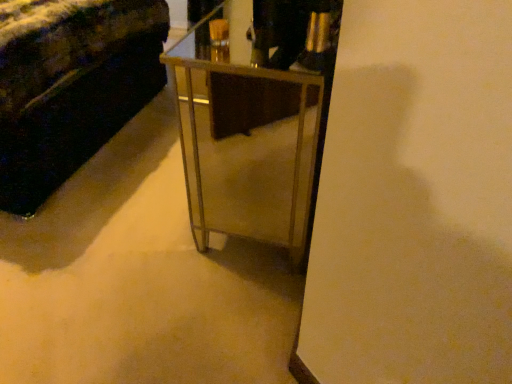
Image resolution: width=512 pixels, height=384 pixels. I want to click on metallic gold table at center, so click(253, 119).

This screenshot has width=512, height=384. What do you see at coordinates (253, 119) in the screenshot?
I see `metallic gold table at center` at bounding box center [253, 119].

Image resolution: width=512 pixels, height=384 pixels. Describe the element at coordinates (70, 86) in the screenshot. I see `velvet dark green couch at left` at that location.

You are a GUI agent. You are given a task and a screenshot of the screen. Output one action in this format:
    pyautogui.click(x=<x>, y=<y>)
    Task: Click on the velvet dark green couch at left
    
    Given the screenshot: What is the action you would take?
    pyautogui.click(x=70, y=86)

What is the approximate height of velvet dark green couch at left?

32.98 inches.

Where is `metallic gold table at center`? Image resolution: width=512 pixels, height=384 pixels. metallic gold table at center is located at coordinates (253, 119).

Is metallic gold table at center at the right side of velvet dark green couch at left?

Yes.

In the scene shown: Which object is closer to the camera taking this photo, metallic gold table at center or velvet dark green couch at left?

Positioned in front is metallic gold table at center.

Considering the points (217, 171) and (94, 147), which point is behind, point (217, 171) or point (94, 147)?

Point (94, 147)

From the image's perspective, which object appears higher, metallic gold table at center or velvet dark green couch at left?

velvet dark green couch at left, from the image's perspective.

From a real-world perspective, is metallic gold table at center positioned above or below velvet dark green couch at left?

In terms of real-world spatial position, metallic gold table at center is below velvet dark green couch at left.

Considering the relative sizes of metallic gold table at center and velvet dark green couch at left in the image provided, is metallic gold table at center thinner than velvet dark green couch at left?

Correct, the width of metallic gold table at center is less than that of velvet dark green couch at left.

Which of these two, metallic gold table at center or velvet dark green couch at left, stands shorter?

metallic gold table at center is shorter.

Considering the sizes of metallic gold table at center and velvet dark green couch at left in the image, is metallic gold table at center bigger or smaller than velvet dark green couch at left?

metallic gold table at center is smaller than velvet dark green couch at left.

Is metallic gold table at center situated inside velvet dark green couch at left or outside?

metallic gold table at center lies outside velvet dark green couch at left.

Can you see metallic gold table at center touching velvet dark green couch at left?

No, metallic gold table at center is not in contact with velvet dark green couch at left.

Consider the image. Is metallic gold table at center oriented away from velvet dark green couch at left?

No, metallic gold table at center is not facing away from velvet dark green couch at left.

Locate an element on the screen. The image size is (512, 384). furniture on the left of metallic gold table at center is located at coordinates coord(70,86).

In the image, is velvet dark green couch at left on the left side or the right side of metallic gold table at center?

Based on their positions, velvet dark green couch at left is located to the left of metallic gold table at center.

Looking at this image, which object is closer to the camera taking this photo, velvet dark green couch at left or metallic gold table at center?

Positioned in front is metallic gold table at center.

Does point (122, 50) come behind point (323, 48)?

Yes, it is.

Based on the photo, from the image's perspective, does velvet dark green couch at left appear lower than metallic gold table at center?

No.

From a real-world perspective, is velvet dark green couch at left physically below metallic gold table at center?

No, from a real-world perspective, velvet dark green couch at left is not under metallic gold table at center.

Considering the relative sizes of velvet dark green couch at left and metallic gold table at center in the image provided, is velvet dark green couch at left thinner than metallic gold table at center?

No, velvet dark green couch at left is not thinner than metallic gold table at center.

Can you confirm if velvet dark green couch at left is shorter than metallic gold table at center?

No, velvet dark green couch at left is not shorter than metallic gold table at center.

Can you confirm if velvet dark green couch at left is smaller than metallic gold table at center?

Actually, velvet dark green couch at left might be larger than metallic gold table at center.

Would you say velvet dark green couch at left contains metallic gold table at center?

No, metallic gold table at center is not surrounded by velvet dark green couch at left.

Would you say velvet dark green couch at left is a long distance from metallic gold table at center?

That's not correct — velvet dark green couch at left is a little close to metallic gold table at center.

Is velvet dark green couch at left turned away from metallic gold table at center?

No, velvet dark green couch at left's orientation is not away from metallic gold table at center.

You are a GUI agent. You are given a task and a screenshot of the screen. Output one action in this format:
    pyautogui.click(x=<x>, y=<y>)
    Task: Click on the table below the velvet dark green couch at left (from a real-world perspective)
    The width and height of the screenshot is (512, 384).
    Given the screenshot: What is the action you would take?
    pyautogui.click(x=253, y=119)

In the image, there is a velvet dark green couch at left. At what (x,y) coordinates should I click in order to perform the action: click on table below it (from a real-world perspective). Please return your answer as a coordinate pair (x, y). The image size is (512, 384). Looking at the image, I should click on (253, 119).

Locate an element on the screen. The width and height of the screenshot is (512, 384). table that appears on the right of velvet dark green couch at left is located at coordinates (253, 119).